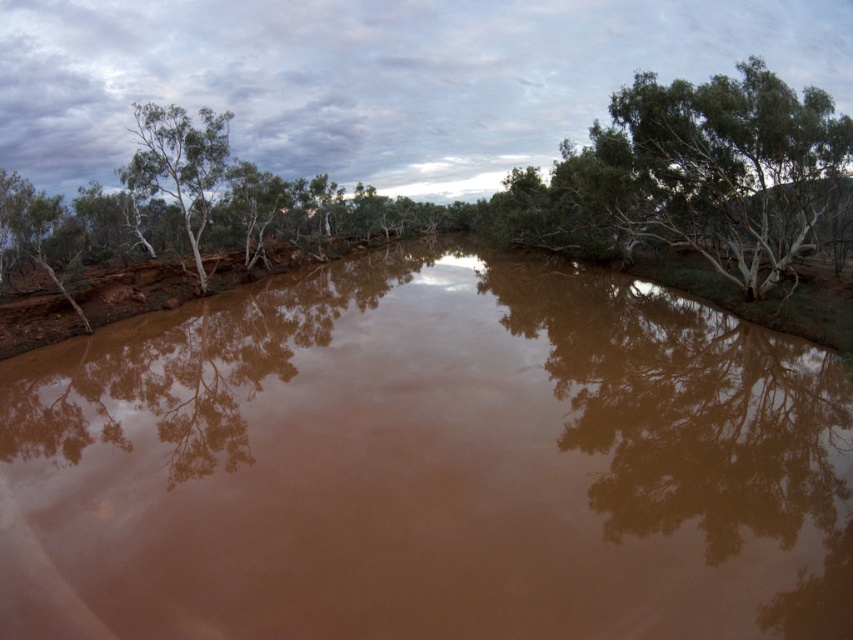
Question: Which point is closer to the camera?

Choices:
 (A) brown matte water at center
 (B) green leafy tree at left

Answer: (A)

Question: Which point is farther to the camera?

Choices:
 (A) brown matte water at center
 (B) green leafy tree at left

Answer: (B)

Question: Which of the following is the closest to the observer?

Choices:
 (A) (189, 225)
 (B) (13, 474)

Answer: (B)

Question: Does brown matte water at center appear under green leafy tree at left?

Choices:
 (A) no
 (B) yes

Answer: (B)

Question: Is brown matte water at center to the right of green leafy tree at left from the viewer's perspective?

Choices:
 (A) yes
 (B) no

Answer: (A)

Question: Can you confirm if brown matte water at center is bigger than green leafy tree at left?

Choices:
 (A) no
 (B) yes

Answer: (A)